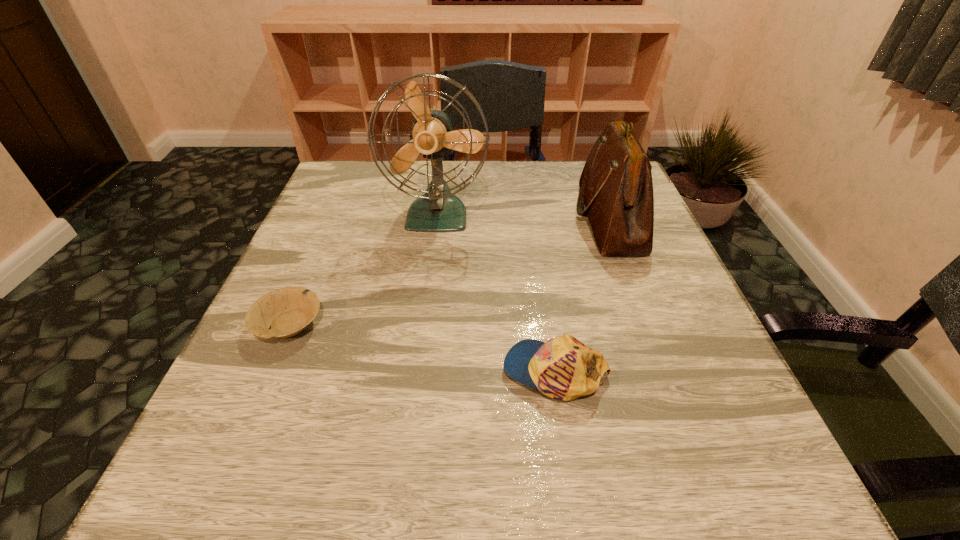
Locate an element on the screen. This screenshot has width=960, height=540. empty space that is in between the fan and the cap is located at coordinates (496, 293).

In order to click on blank region between the fan and the third shortest object in this screenshot , I will do `click(523, 217)`.

The image size is (960, 540). What are the coordinates of `free space between the shortest object and the cap` in the screenshot? It's located at (422, 348).

This screenshot has height=540, width=960. Identify the location of object that is the third closest to the fan. (563, 368).

You are a GUI agent. You are given a task and a screenshot of the screen. Output one action in this format:
    pyautogui.click(x=<x>, y=<y>)
    Task: Click on the object that is the third nearest to the shoulder bag
    The height and width of the screenshot is (540, 960).
    Given the screenshot: What is the action you would take?
    pyautogui.click(x=287, y=311)

I want to click on free space that satisfies the following two spatial constraints: 1. on the front side of the second tallest object; 2. on the bill of the third object from left to right, so click(x=667, y=371).

Where is `vacant space that satisfies the following two spatial constraints: 1. on the front-facing side of the second object from left to right for air flow; 2. on the right side of the rightmost object`? The image size is (960, 540). vacant space that satisfies the following two spatial constraints: 1. on the front-facing side of the second object from left to right for air flow; 2. on the right side of the rightmost object is located at coordinates (438, 219).

The width and height of the screenshot is (960, 540). Find the location of `free location that satisfies the following two spatial constraints: 1. on the front-facing side of the tallest object for air flow; 2. on the right side of the second tallest object`. free location that satisfies the following two spatial constraints: 1. on the front-facing side of the tallest object for air flow; 2. on the right side of the second tallest object is located at coordinates (438, 219).